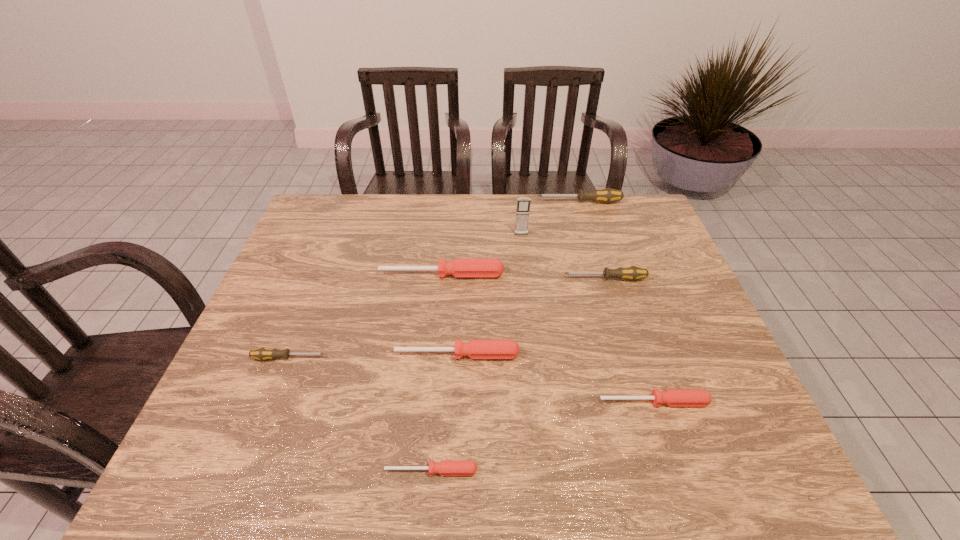
At what (x,y) coordinates should I click in order to perform the action: click on red screwdriver that stands as the closest to the farthest red screwdriver. Please return your answer as a coordinate pair (x, y). Looking at the image, I should click on (476, 349).

Locate an element on the screen. the second closest red screwdriver to the seventh farthest object is located at coordinates (446, 467).

This screenshot has width=960, height=540. Find the location of `free space that satisfies the following two spatial constraints: 1. at the tip of the rightmost red screwdriver; 2. on the left side of the second biggest gray screwdriver`. free space that satisfies the following two spatial constraints: 1. at the tip of the rightmost red screwdriver; 2. on the left side of the second biggest gray screwdriver is located at coordinates (642, 402).

Locate an element on the screen. The height and width of the screenshot is (540, 960). free spot that satisfies the following two spatial constraints: 1. at the tip of the second biggest gray screwdriver; 2. on the front side of the third smallest red screwdriver is located at coordinates (628, 355).

Identify the location of vacant space that satisfies the following two spatial constraints: 1. at the tip of the nearest red screwdriver; 2. on the right side of the smallest gray screwdriver. The image size is (960, 540). (246, 471).

This screenshot has width=960, height=540. Identify the location of free spot that satisfies the following two spatial constraints: 1. on the front-facing side of the gray cellular telephone; 2. at the tip of the leftmost gray screwdriver. (535, 358).

Find the location of a particular element. blank area in the image that satisfies the following two spatial constraints: 1. on the front-facing side of the fifth object from left to right; 2. at the tip of the leftmost screwdriver is located at coordinates (535, 358).